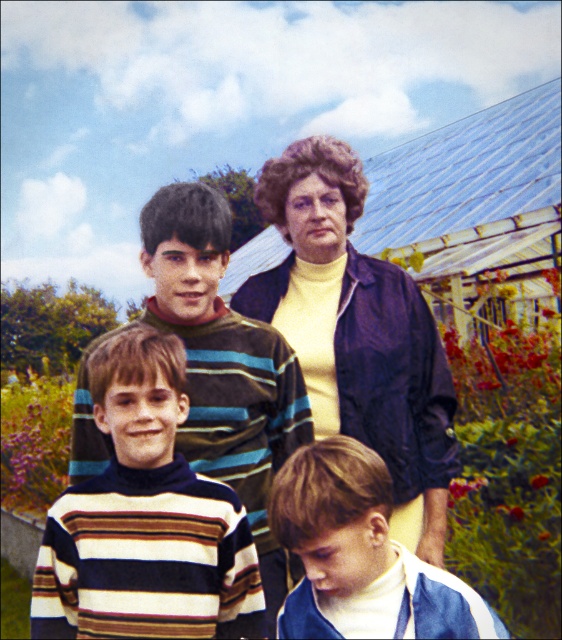
Is striped turtleneck sweater at center positioned before matte yellow sweater at center?

That is True.

You are a GUI agent. You are given a task and a screenshot of the screen. Output one action in this format:
    pyautogui.click(x=<x>, y=<y>)
    Task: Click on the striped turtleneck sweater at center
    Image resolution: width=562 pixels, height=640 pixels.
    Given the screenshot: What is the action you would take?
    pyautogui.click(x=146, y=518)

This screenshot has height=640, width=562. Find the location of `striped turtleneck sweater at center`. striped turtleneck sweater at center is located at coordinates (146, 518).

Is point (116, 528) more distant than point (352, 502)?

Yes, point (116, 528) is farther from viewer.

Can you confirm if striped turtleneck sweater at center is shorter than striped sweater at lower center?

In fact, striped turtleneck sweater at center may be taller than striped sweater at lower center.

Is point (134, 483) positioned before point (415, 564)?

No, (134, 483) is further to viewer.

Locate an element on the screen. striped turtleneck sweater at center is located at coordinates (146, 518).

Can you confirm if matte yellow sweater at center is shorter than striped sweater at lower center?

In fact, matte yellow sweater at center may be taller than striped sweater at lower center.

Is point (402, 301) positioned after point (296, 484)?

That is True.

Is point (427, 452) positioned behind point (360, 480)?

Yes, it is behind point (360, 480).

You are a GUI agent. You are given a task and a screenshot of the screen. Output one action in this format:
    pyautogui.click(x=<x>, y=<y>)
    Task: Click on the matte yellow sweater at center
    This screenshot has width=562, height=640.
    Given the screenshot: What is the action you would take?
    pyautogui.click(x=357, y=333)